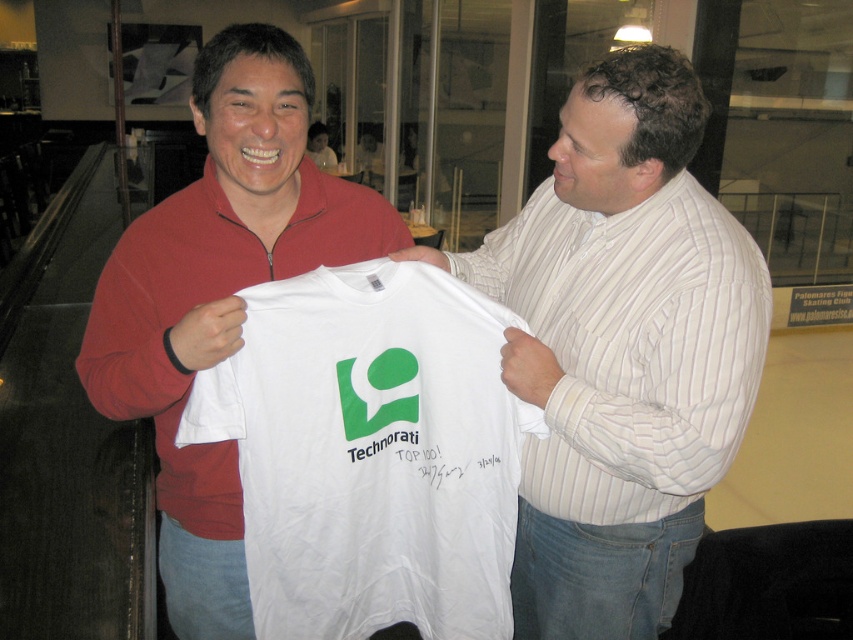
Who is taller, white cotton shirt at center or white cotton t-shirt at center?

With more height is white cotton shirt at center.

Which is in front, point (654, 451) or point (248, 568)?

Point (248, 568) is more forward.

The width and height of the screenshot is (853, 640). What do you see at coordinates (621, 349) in the screenshot? I see `white cotton shirt at center` at bounding box center [621, 349].

At what (x,y) coordinates should I click in order to perform the action: click on white cotton shirt at center. Please return your answer as a coordinate pair (x, y). Looking at the image, I should click on (621, 349).

Is white cotton shirt at center bigger than matte red zip-up sweater at left?

Yes, white cotton shirt at center is bigger than matte red zip-up sweater at left.

Between white cotton shirt at center and matte red zip-up sweater at left, which one has less height?

matte red zip-up sweater at left is shorter.

Is point (596, 413) farther from viewer compared to point (224, 339)?

Yes, point (596, 413) is behind point (224, 339).

Locate an element on the screen. The width and height of the screenshot is (853, 640). white cotton shirt at center is located at coordinates (621, 349).

Between white cotton t-shirt at center and matte red zip-up sweater at left, which one has less height?

white cotton t-shirt at center is shorter.

Does white cotton t-shirt at center appear on the right side of matte red zip-up sweater at left?

Correct, you'll find white cotton t-shirt at center to the right of matte red zip-up sweater at left.

Who is more forward, (496, 598) or (271, 205)?

Point (496, 598) is more forward.

Find the location of a particular element. This screenshot has width=853, height=640. white cotton t-shirt at center is located at coordinates (370, 452).